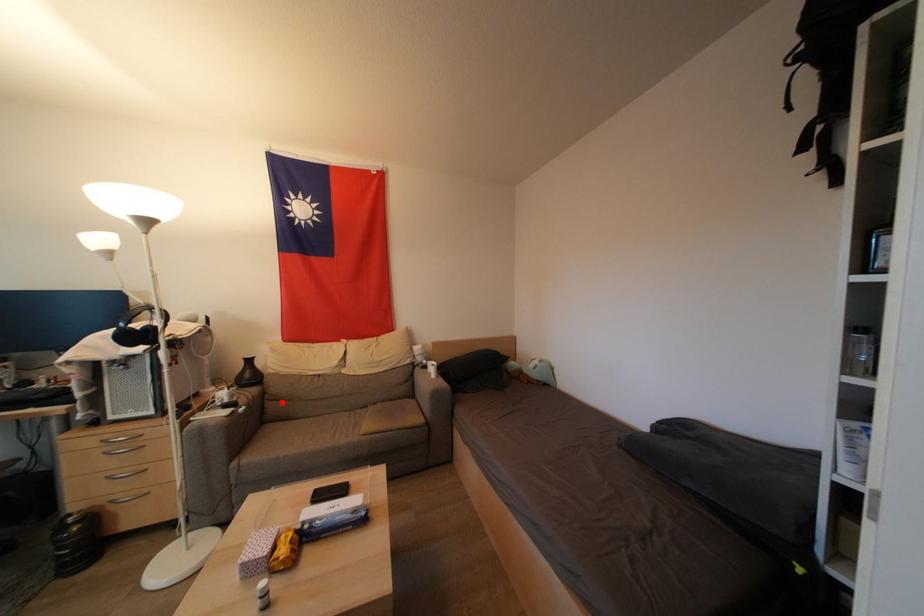
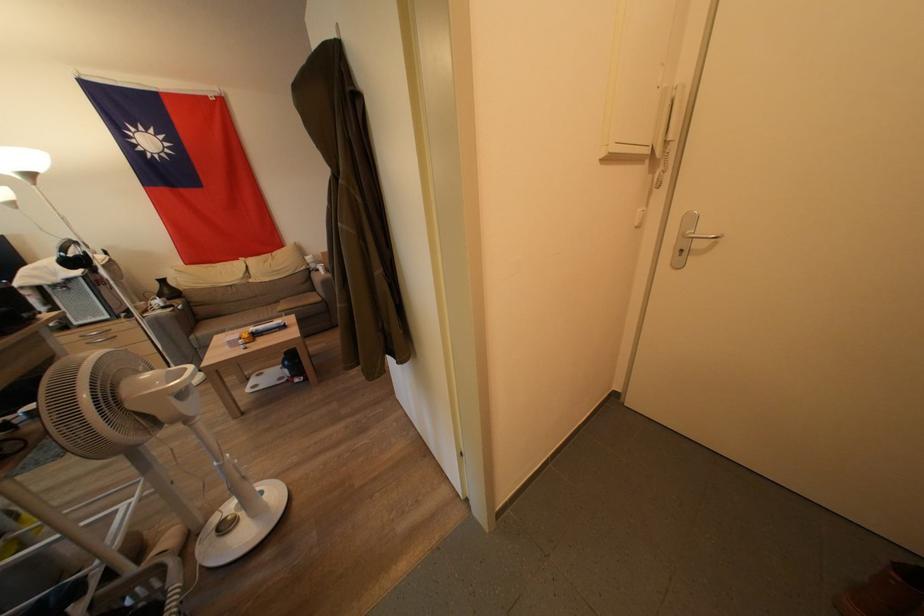
Question: I am providing you with two images of the same scene from different viewpoints. Image1 has a red point marked. In image2, the corresponding 3D location appears at what relative position? Reply with the corresponding letter.

Choices:
 (A) Closer
 (B) Farther

Answer: (A)